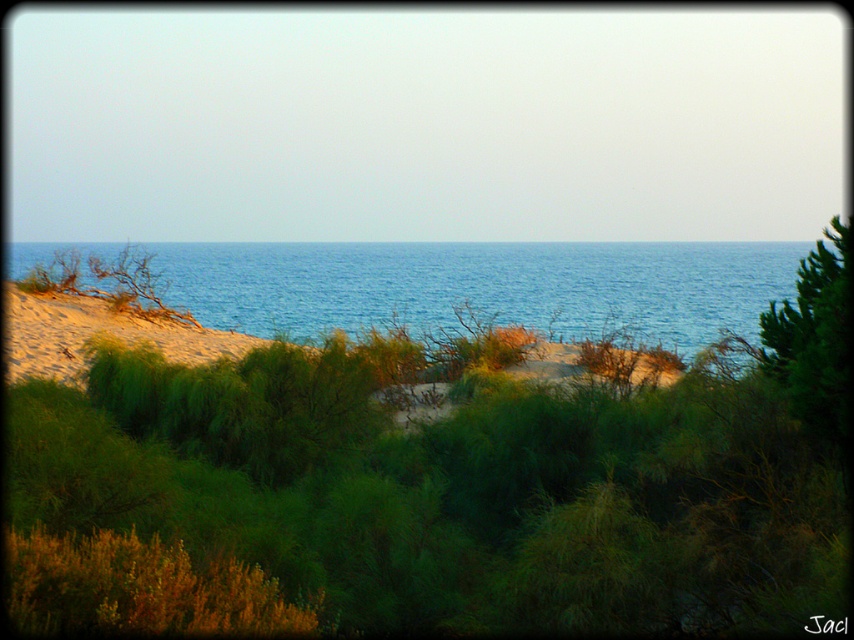
You are a photographer planning to capture the coastal landscape. You want to ensure that both the blue water at center and the sandy beach at left are visible in your shot. Given their sizes, which object should you frame to prioritize in your composition?

The blue water at center is larger than the sandy beach at left, so you should prioritize framing the blue water at center to accommodate its size in the composition.

You are standing on the sandy beach at left and want to reach the blue water at center. Based on the scene description, which direction should you move to get to the water?

Since the blue water at center is wider than the sandy beach at left, you should move towards the center of the scene where the blue water at center is located to reach it.